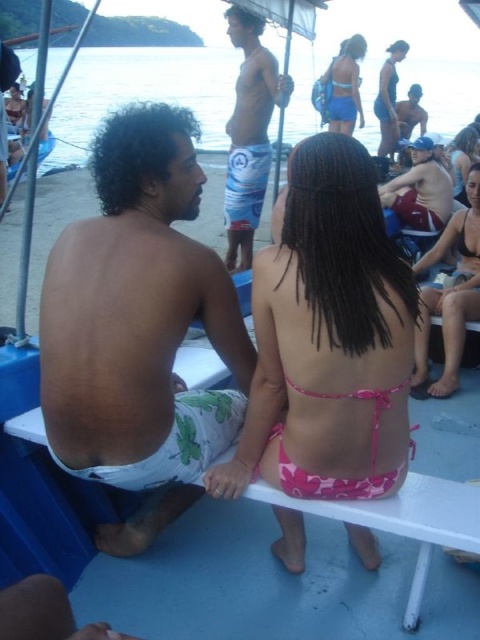
You are a photographer trying to capture the pink fabric bikini at upper right in the image. The camera you are using has a rectangular viewfinder with a fixed aspect ratio of 4x6. You want to frame the scene so that the bikini is centered in the viewfinder. Given that the point marking the bikini is located at coordinates point (463, 157), can you determine if the entire bikini will fit within the viewfinder when centered on this point?

The point (463, 157) marks the pink fabric bikini at upper right. Since the viewfinder has a 4x6 aspect ratio and the bikini is centered at this point, the entire bikini will fit within the viewfinder as long as the area around the point within the viewfinder dimensions includes the bikini without cropping it. However, without knowing the exact size of the bikini relative to the image frame, we can confirm the centering is correct, but cannot guarantee full visibility due to potential edge constraints.

You are on a boat and need to hand a life jacket to the person wearing the blue printed shorts at center. There is another person with matte blue shorts at center nearby. Which one should you approach first based on their position?

You should approach the blue printed shorts at center first because it is closer to the viewer than the matte blue shorts at center.

You are standing on the boat and want to move from point (x=456, y=147) to point (x=0, y=140). Which direction should you move to get closer to the camera?

You should move towards point (x=0, y=140) because it is closer to the camera compared to point (x=456, y=147).